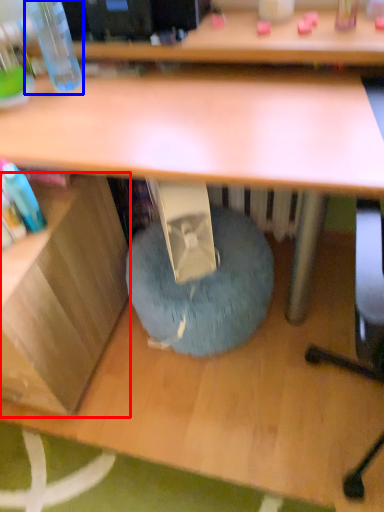
Question: Which object appears farthest to the camera in this image, shelf (highlighted by a red box) or bottle (highlighted by a blue box)?

Choices:
 (A) shelf
 (B) bottle

Answer: (B)